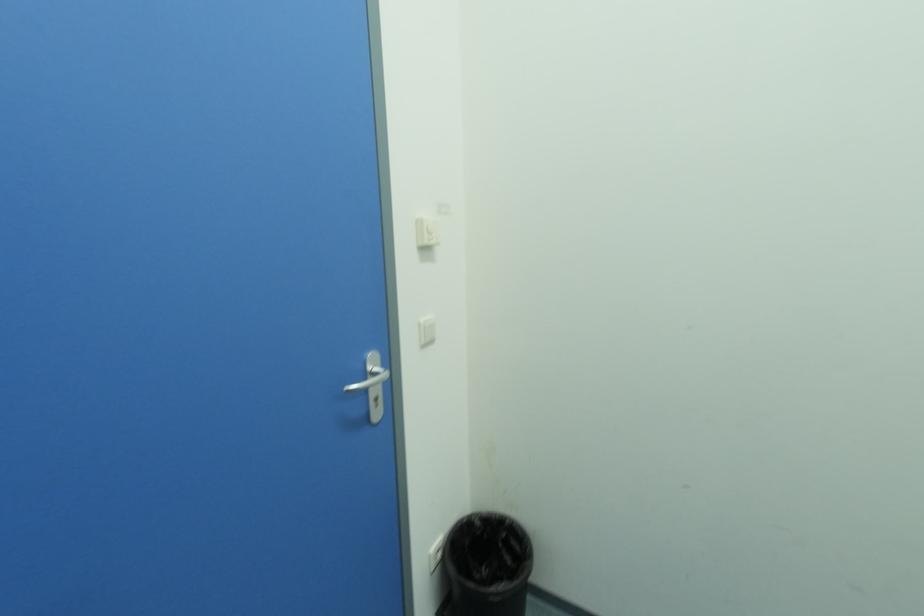
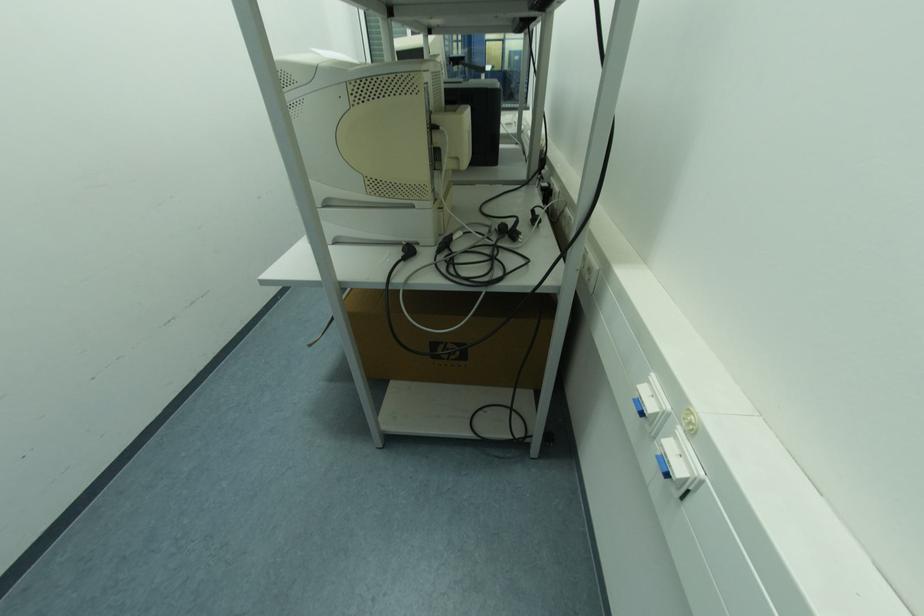
The images are taken continuously from a first-person perspective. In which direction is your viewpoint rotating?

The camera rotated toward right-down.